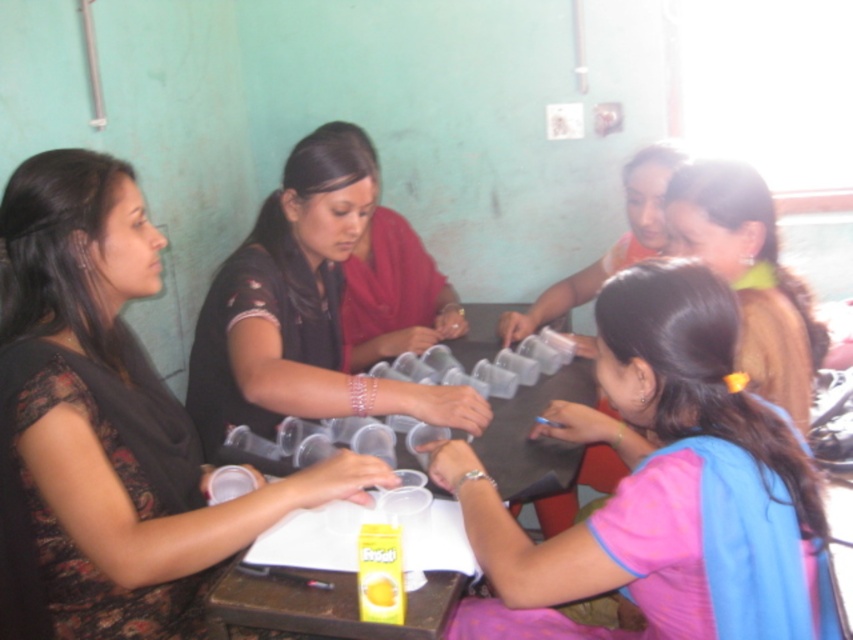
Is black matte shirt at center smaller than translucent plastic juice at center?

Incorrect, black matte shirt at center is not smaller in size than translucent plastic juice at center.

This screenshot has height=640, width=853. Describe the element at coordinates (299, 308) in the screenshot. I see `black matte shirt at center` at that location.

Which is behind, point (212, 449) or point (390, 600)?

The point (212, 449) is behind.

The image size is (853, 640). I want to click on black matte shirt at center, so click(299, 308).

Measure the distance between point (766,218) and camera.

Point (766,218) is 5.24 feet away from camera.

Does brown fabric hair tie at upper right appear on the right side of translucent plastic juice at center?

Yes, brown fabric hair tie at upper right is to the right of translucent plastic juice at center.

Locate an element on the screen. The image size is (853, 640). brown fabric hair tie at upper right is located at coordinates (749, 275).

Identify the location of brown fabric hair tie at upper right. (749, 275).

Identify the location of transparent plastic cups at center. This screenshot has height=640, width=853. (534, 440).

Is point (215, 588) positioned before point (392, 577)?

No, (215, 588) is behind (392, 577).

Identify the location of transparent plastic cups at center. This screenshot has width=853, height=640. tap(534, 440).